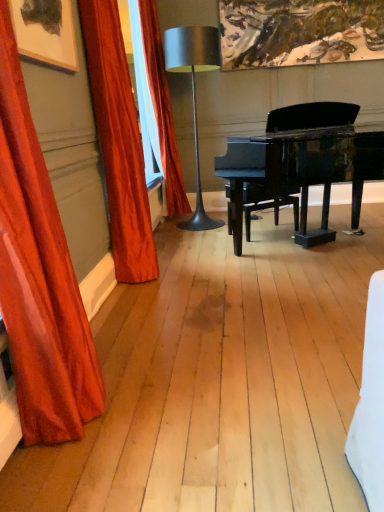
The image size is (384, 512). Identify the location of unoccupied region to the right of satin red curtain at left, acting as the 1th curtain starting from the front. (173, 396).